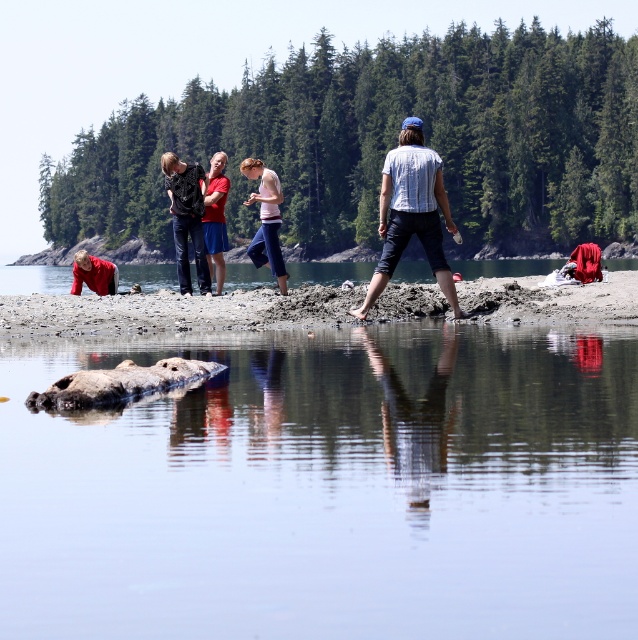
Is point (452, 529) less distant than point (426, 244)?

Yes, point (452, 529) is in front of point (426, 244).

Find the location of a particular element. smooth gray rock at center is located at coordinates coord(329,490).

Looking at this image, is striped shirt at center shorter than matte black clothing at center?

Correct, striped shirt at center is not as tall as matte black clothing at center.

Between striped shirt at center and matte black clothing at center, which one is positioned higher?

matte black clothing at center is above.

Is point (415, 161) closer to viewer compared to point (262, 250)?

Yes, it is.

Locate an element on the screen. The image size is (638, 640). striped shirt at center is located at coordinates (412, 212).

Can you confirm if smooth gray rock at center is taller than brown sandy beach at center?

Indeed, smooth gray rock at center has a greater height compared to brown sandy beach at center.

Is point (390, 372) positioned before point (408, 317)?

Yes, point (390, 372) is closer to viewer.

I want to click on smooth gray rock at center, so click(x=329, y=490).